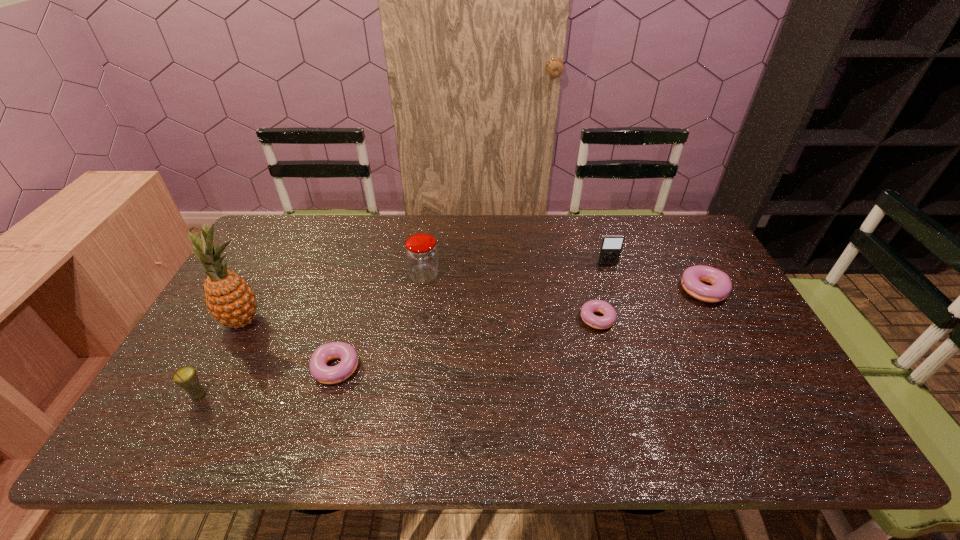
Point out which object is positioned as the second nearest to the straw for drinking. Please provide its 2D coordinates. Your answer should be formatted as a tuple, i.e. [(x, y)], where the tuple contains the x and y coordinates of a point satisfying the conditions above.

[(319, 370)]

The width and height of the screenshot is (960, 540). I want to click on object that is the third nearest to the straw for drinking, so click(421, 251).

The width and height of the screenshot is (960, 540). I want to click on doughnut that stands as the second closest to the straw for drinking, so click(x=598, y=322).

Select which doughnut is the third closest to the straw for drinking. Please provide its 2D coordinates. Your answer should be formatted as a tuple, i.e. [(x, y)], where the tuple contains the x and y coordinates of a point satisfying the conditions above.

[(721, 283)]

The width and height of the screenshot is (960, 540). In order to click on vacant space that satisfies the following two spatial constraints: 1. on the front-facing side of the fourth tallest object; 2. on the right side of the rightmost doughnut in this screenshot , I will do `click(617, 294)`.

You are a GUI agent. You are given a task and a screenshot of the screen. Output one action in this format:
    pyautogui.click(x=<x>, y=<y>)
    Task: Click on the vacant space that satisfies the following two spatial constraints: 1. on the front-facing side of the rightmost object; 2. on the left side of the farthest object
    The image size is (960, 540).
    Given the screenshot: What is the action you would take?
    pyautogui.click(x=617, y=294)